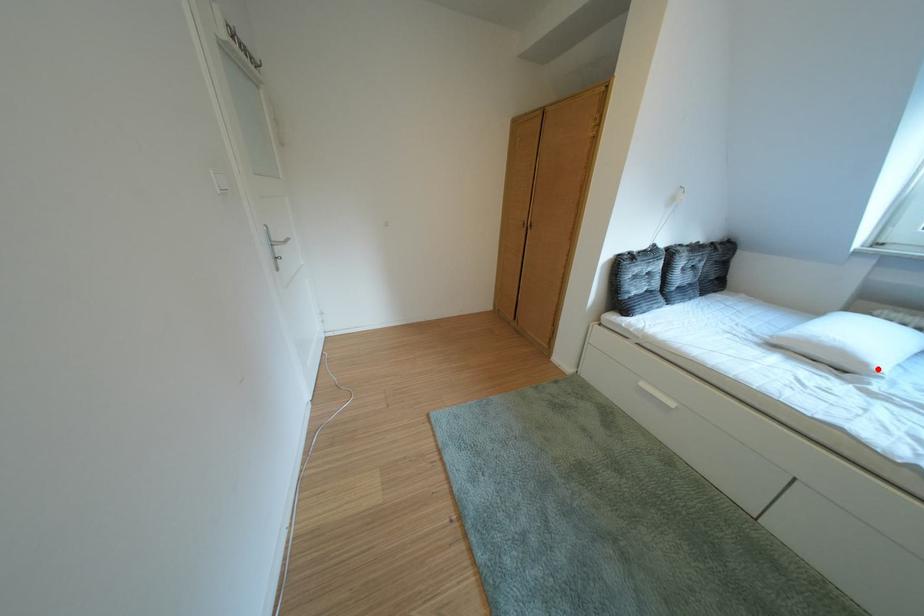
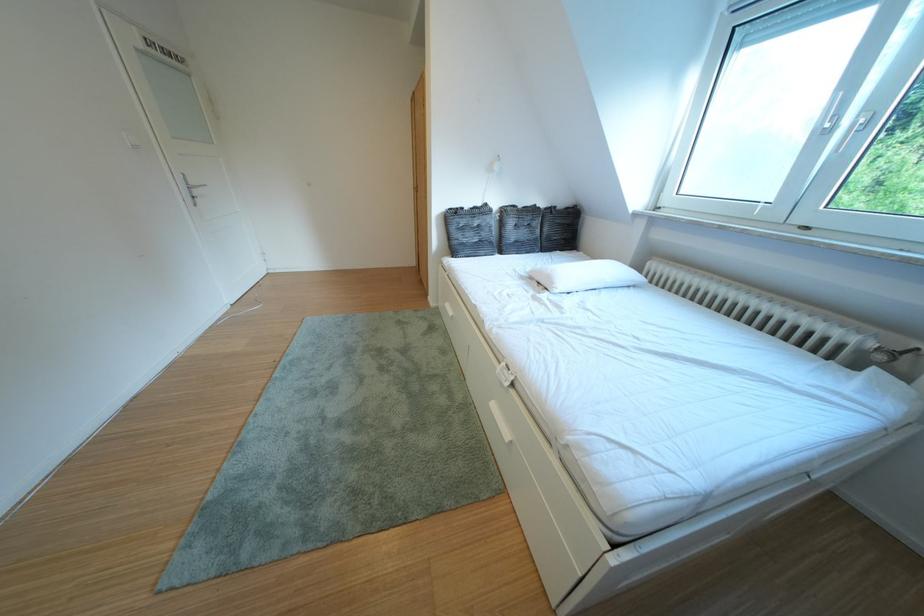
Where in the second image is the point corresponding to the highlighted location from the first image?

(565, 288)